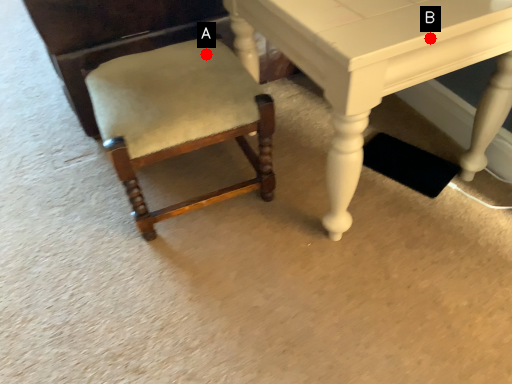
Question: Two points are circled on the image, labeled by A and B beside each circle. Which point is farther from the camera taking this photo?

Choices:
 (A) A is further
 (B) B is further

Answer: (A)